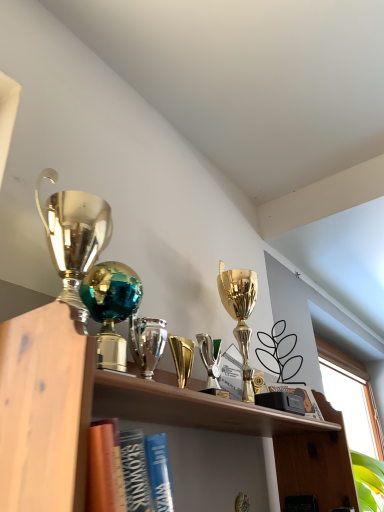
Question: Is shiny teal glass globe at center, which is counted as the 2th trophy, starting from the right, to the right of shiny silver trophy at center, the 2th trophy positioned from the left, from the viewer's perspective?

Choices:
 (A) no
 (B) yes

Answer: (A)

Question: Considering the relative sizes of shiny teal glass globe at center, the 1th trophy viewed from the left, and shiny silver trophy at center, the 2th trophy positioned from the left, in the image provided, is shiny teal glass globe at center, the 1th trophy viewed from the left, shorter than shiny silver trophy at center, the 2th trophy positioned from the left,?

Choices:
 (A) yes
 (B) no

Answer: (B)

Question: Is shiny teal glass globe at center, the 1th trophy viewed from the left, facing away from shiny silver trophy at center, the 2th trophy positioned from the left?

Choices:
 (A) yes
 (B) no

Answer: (B)

Question: Can you confirm if shiny teal glass globe at center, the 1th trophy viewed from the left, is wider than shiny silver trophy at center, the 2th trophy positioned from the left?

Choices:
 (A) yes
 (B) no

Answer: (A)

Question: From the image's perspective, does shiny teal glass globe at center, which is counted as the 2th trophy, starting from the right, appear lower than shiny silver trophy at center, which ranks as the first trophy in right-to-left order?

Choices:
 (A) yes
 (B) no

Answer: (B)

Question: Relative to shiny teal glass globe at center, which is counted as the 2th trophy, starting from the right, is shiny silver trophy at center, which ranks as the first trophy in right-to-left order, in front or behind?

Choices:
 (A) front
 (B) behind

Answer: (B)

Question: Visually, is shiny silver trophy at center, the 2th trophy positioned from the left, positioned to the left or to the right of shiny teal glass globe at center, the 1th trophy viewed from the left?

Choices:
 (A) left
 (B) right

Answer: (B)

Question: Considering the positions of shiny silver trophy at center, which ranks as the first trophy in right-to-left order, and shiny teal glass globe at center, which is counted as the 2th trophy, starting from the right, in the image, is shiny silver trophy at center, which ranks as the first trophy in right-to-left order, bigger or smaller than shiny teal glass globe at center, which is counted as the 2th trophy, starting from the right,?

Choices:
 (A) small
 (B) big

Answer: (A)

Question: From the image's perspective, is shiny silver trophy at center, which ranks as the first trophy in right-to-left order, positioned above or below shiny teal glass globe at center, the 1th trophy viewed from the left?

Choices:
 (A) above
 (B) below

Answer: (B)

Question: Is shiny teal glass globe at center, the 1th trophy viewed from the left, inside the boundaries of black matte book at center, or outside?

Choices:
 (A) inside
 (B) outside

Answer: (B)

Question: In terms of size, does shiny teal glass globe at center, which is counted as the 2th trophy, starting from the right, appear bigger or smaller than black matte book at center?

Choices:
 (A) small
 (B) big

Answer: (B)

Question: Based on their positions, is shiny teal glass globe at center, the 1th trophy viewed from the left, located to the left or right of black matte book at center?

Choices:
 (A) right
 (B) left

Answer: (B)

Question: Considering the positions of point (107, 342) and point (271, 389), is point (107, 342) closer or farther from the camera than point (271, 389)?

Choices:
 (A) closer
 (B) farther

Answer: (A)

Question: From the image's perspective, relative to shiny teal glass globe at center, which is counted as the 2th trophy, starting from the right, is black matte book at center above or below?

Choices:
 (A) above
 (B) below

Answer: (B)

Question: Is black matte book at center in front of or behind shiny teal glass globe at center, which is counted as the 2th trophy, starting from the right, in the image?

Choices:
 (A) behind
 (B) front

Answer: (A)